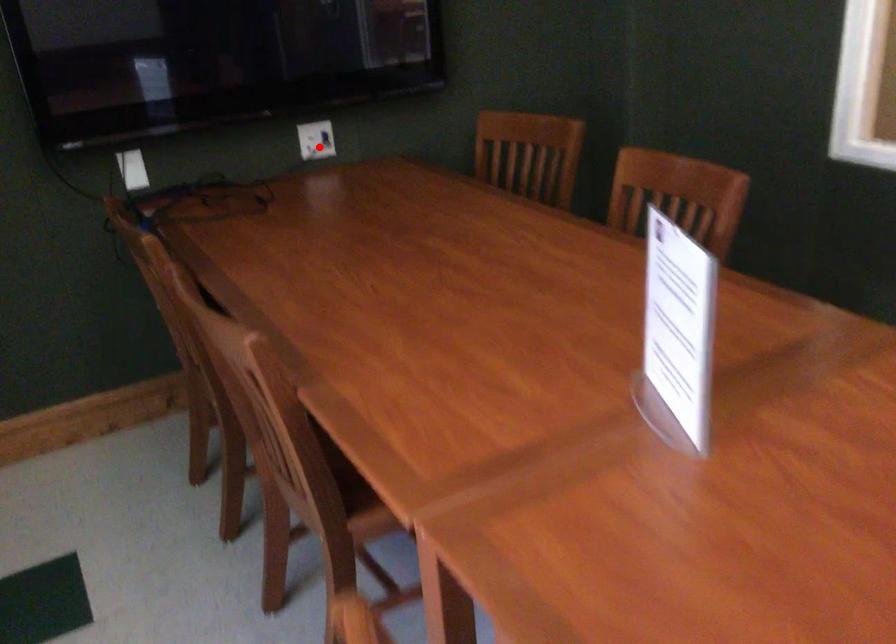
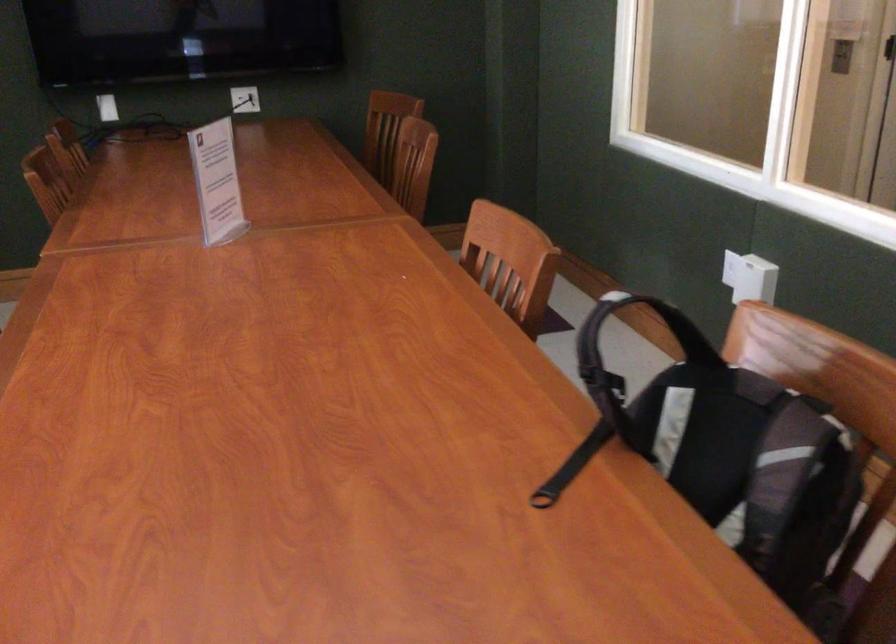
Find the pixel in the second image that matches the highlighted location in the first image.

(245, 99)